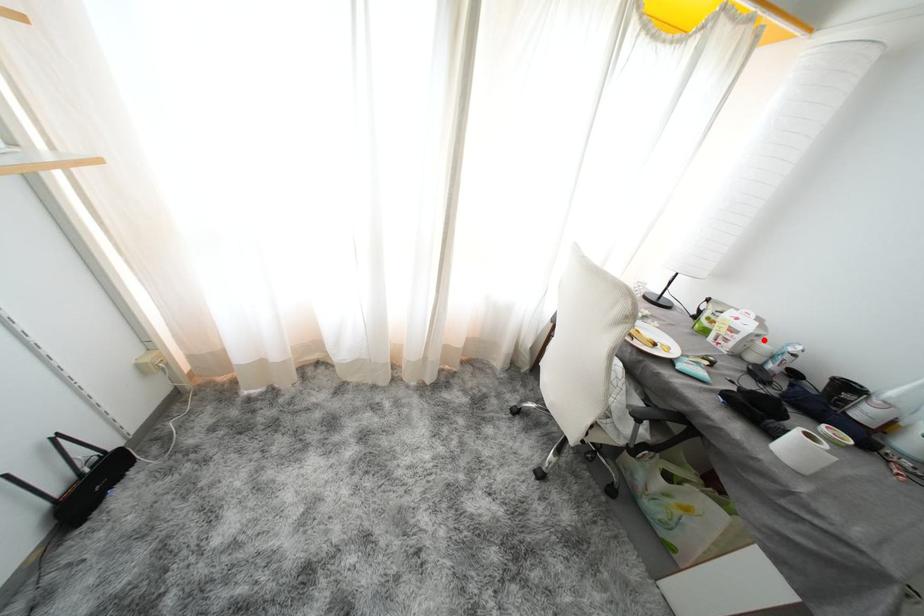
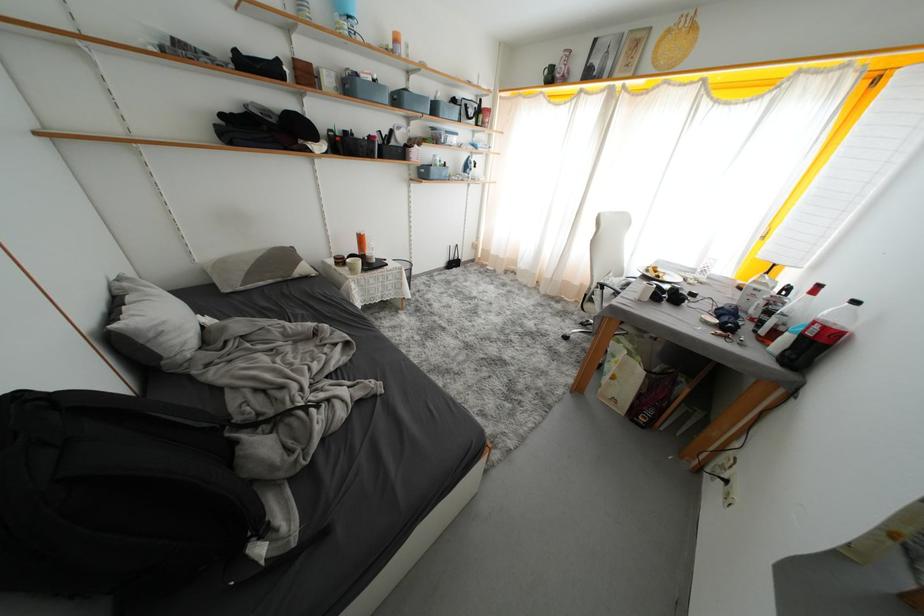
Locate, in the second image, the point that corresponds to the highlighted location in the first image.

(761, 293)